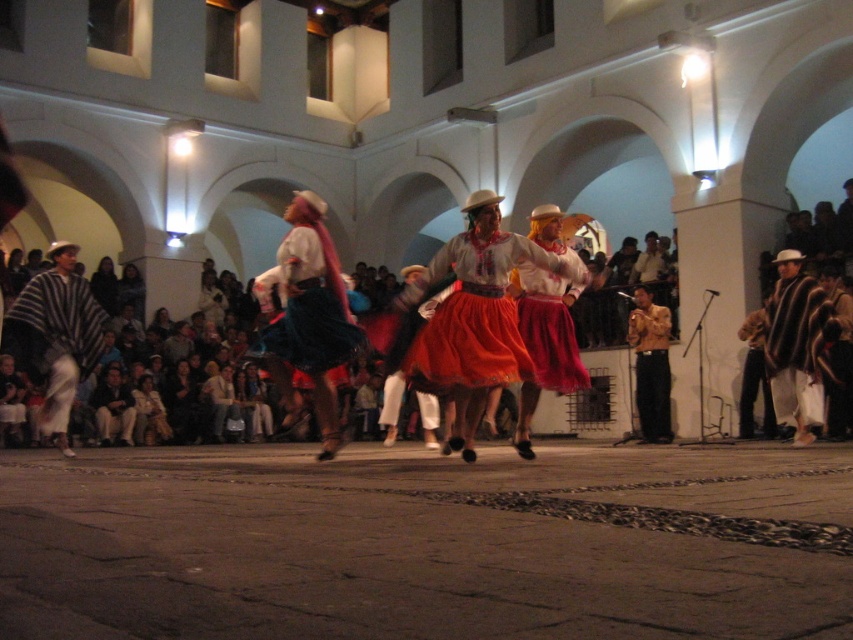
You are a photographer trying to capture the dance performance. You notice the striped wool poncho at left and the red satin skirt at center. Which object should you focus on if you want to photograph the smaller one?

The striped wool poncho at left has a smaller size compared to the red satin skirt at center, so you should focus on the striped wool poncho at left.

You are a photographer standing in the courtyard and want to capture the dancer wearing the matte orange skirt at center. Based on the coordinates provided, where should you position your camera to ensure the skirt is in the center of your photo?

The matte orange skirt at center is located at coordinates point (477, 312), so positioning the camera directly facing that point will ensure the skirt is centered in the photo.

You are a photographer trying to capture the dancers in the courtyard. You notice two central outfits, the matte red skirt at center and the matte black dress at center. Which one will require you to focus on a lower part of the body to get a clear shot?

The matte red skirt at center is shorter than the matte black dress at center, so you should focus on the lower part of the matte red skirt at center to get a clear shot.